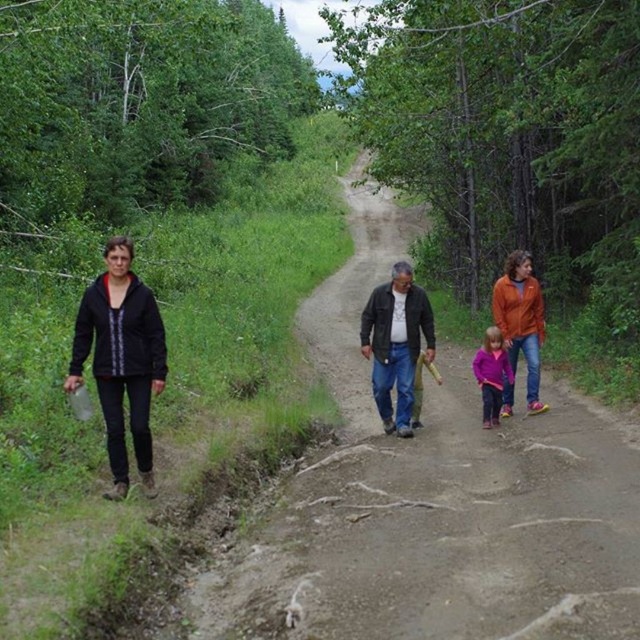
Question: Which object is the closest to the orange fleece jacket at center?

Choices:
 (A) dark brown leather jacket at center
 (B) black matte jacket at left
 (C) orange fleece jacket at center-right
 (D) purple fleece jacket at center

Answer: (C)

Question: Is orange fleece jacket at center-right positioned at the back of purple fleece jacket at center?

Choices:
 (A) no
 (B) yes

Answer: (A)

Question: Which point appears farthest from the camera in this image?

Choices:
 (A) (486, 426)
 (B) (385, 292)
 (C) (493, 310)
 (D) (529, 308)

Answer: (C)

Question: Is orange fleece jacket at center further to camera compared to purple fleece jacket at center?

Choices:
 (A) yes
 (B) no

Answer: (B)

Question: Can you confirm if orange fleece jacket at center-right is positioned to the right of purple fleece jacket at center?

Choices:
 (A) yes
 (B) no

Answer: (A)

Question: Among these points, which one is nearest to the camera?

Choices:
 (A) (68, 369)
 (B) (499, 339)

Answer: (A)